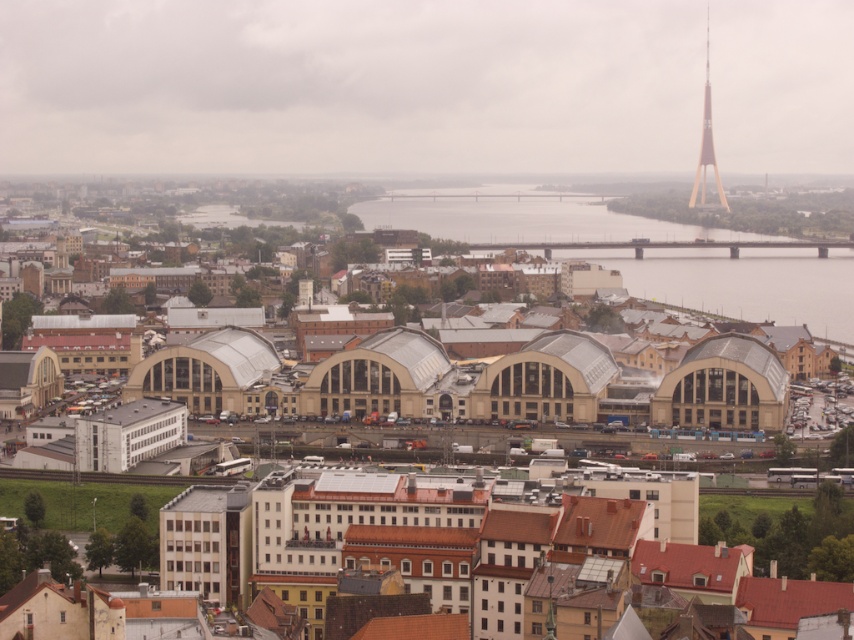
Is gray concrete water at center bigger than metallic gold tower at upper right?

Indeed, gray concrete water at center has a larger size compared to metallic gold tower at upper right.

Image resolution: width=854 pixels, height=640 pixels. What are the coordinates of `gray concrete water at center` in the screenshot? It's located at (741, 282).

Which is in front, point (711, 246) or point (706, 132)?

Point (711, 246) is in front.

Where is `gray concrete water at center`? gray concrete water at center is located at coordinates (741, 282).